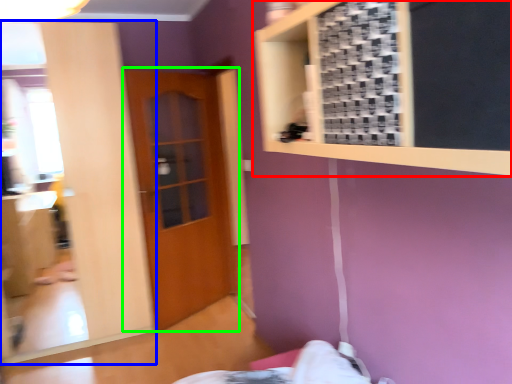
Question: Which is nearer to the bulletin board (highlighted by a red box)? mirror (highlighted by a blue box) or door (highlighted by a green box).

Choices:
 (A) mirror
 (B) door

Answer: (A)